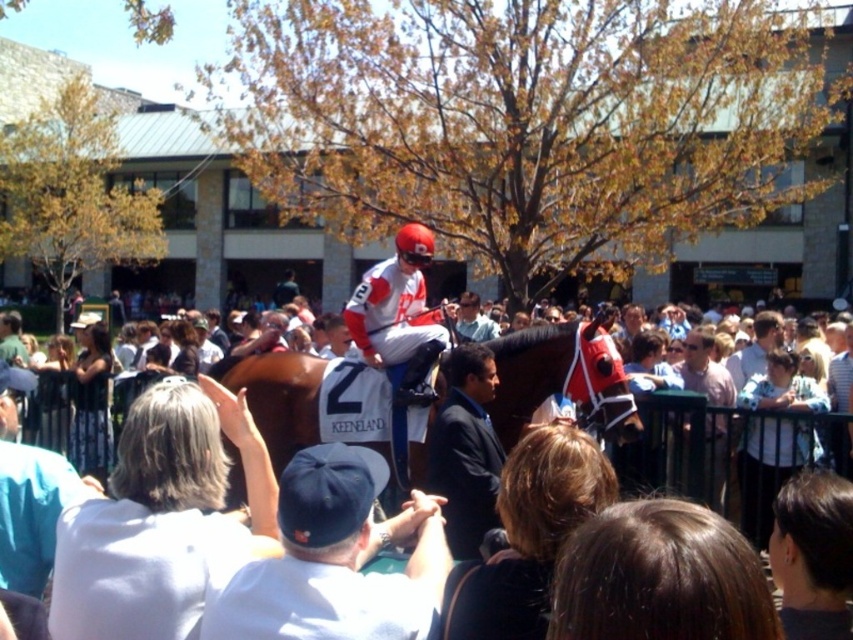
You are a photographer standing at the starting line of the race. You want to take a photo of the white fabric crowd at center and the white cotton cap at center. How far apart are these two objects from each other?

The white fabric crowd at center and the white cotton cap at center are 6.45 meters apart from each other.

You are a photographer standing at the point where the image was taken. You want to capture a photo of the jockey and the horse in the foreground while also including the crowd behind the green metal fence in the background. Given the depth of field required to keep both the foreground and background in focus, would the distance of point (347, 394) from the viewer at 76.46 feet help achieve this?

The distance of point (347, 394) from the viewer is 76.46 feet. To achieve a depth of field that keeps both the foreground jockey and horse and the background crowd in focus, the photographer should ensure the hyperfocal distance is set appropriately. Since the crowd is further away than the foreground subjects, the given distance of 76.46 feet for the point might be part of the background elements. However, without knowing the exact hyperfocal distance calculation based on aperture and sensor size, it is